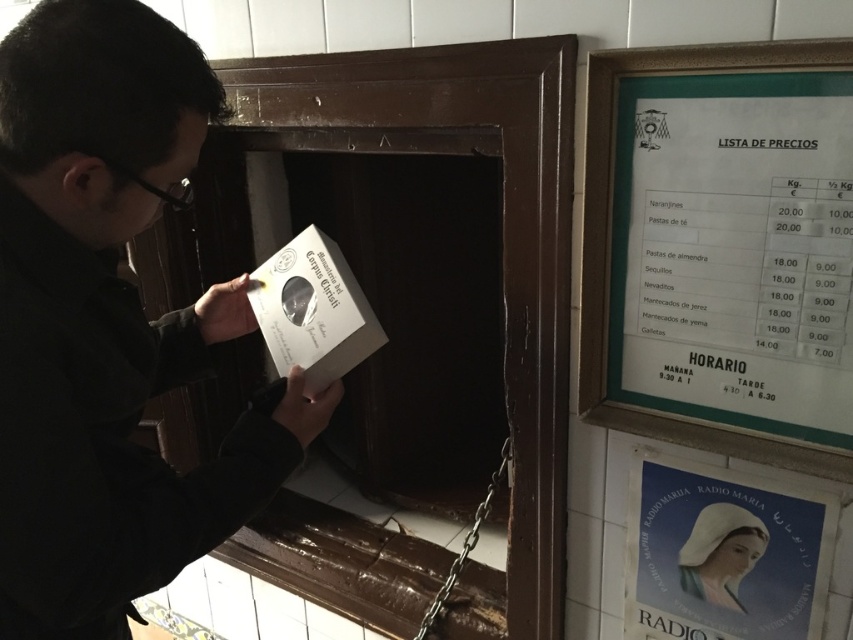
Between green cardboard sign at upper right and smooth white portrait at center, which one appears on the right side from the viewer's perspective?

From the viewer's perspective, smooth white portrait at center appears more on the right side.

Does green cardboard sign at upper right appear over smooth white portrait at center?

Yes, green cardboard sign at upper right is above smooth white portrait at center.

At what (x,y) coordinates should I click in order to perform the action: click on green cardboard sign at upper right. Please return your answer as a coordinate pair (x, y). The width and height of the screenshot is (853, 640). Looking at the image, I should click on (721, 248).

Does wooden frame at upper right come behind blue paper poster at lower right?

Yes, it is.

Who is positioned more to the right, wooden frame at upper right or blue paper poster at lower right?

From the viewer's perspective, blue paper poster at lower right appears more on the right side.

Looking at this image, who is more distant from viewer, (563, 83) or (741, 529)?

Positioned behind is point (741, 529).

Identify the location of wooden frame at upper right. The image size is (853, 640). (372, 256).

Between point (532, 100) and point (786, 300), which one is positioned behind?

The point (532, 100) is more distant.

Can you confirm if wooden frame at upper right is shorter than green cardboard sign at upper right?

Incorrect, wooden frame at upper right's height does not fall short of green cardboard sign at upper right's.

Which is in front, point (548, 230) or point (624, 420)?

Positioned in front is point (548, 230).

The height and width of the screenshot is (640, 853). Find the location of `wooden frame at upper right`. wooden frame at upper right is located at coordinates (372, 256).